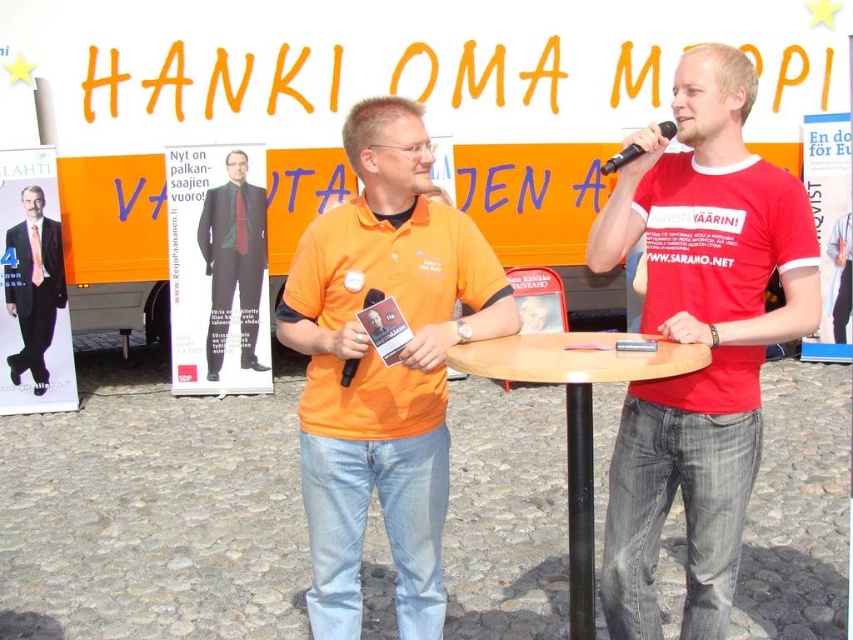
Based on the coordinates provided, which object is located at point [233,260] in the image?

The point [233,260] corresponds to the dark suit at center.